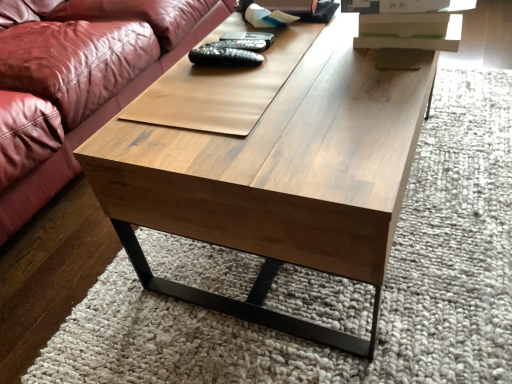
At what (x,y) coordinates should I click in order to perform the action: click on vacant area that lies in front of black matte remote at center, which ranks as the second remote in top-to-bottom order. Please return your answer as a coordinate pair (x, y). Image resolution: width=512 pixels, height=384 pixels. Looking at the image, I should click on (x=232, y=90).